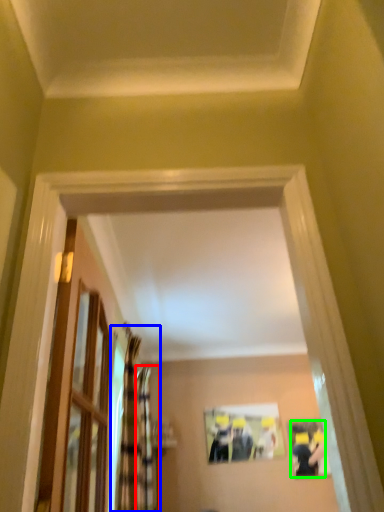
Question: Which object is positioned closest to curtain (highlighted by a red box)? Select from curtain (highlighted by a blue box) and couple (highlighted by a green box).

Choices:
 (A) curtain
 (B) couple

Answer: (A)